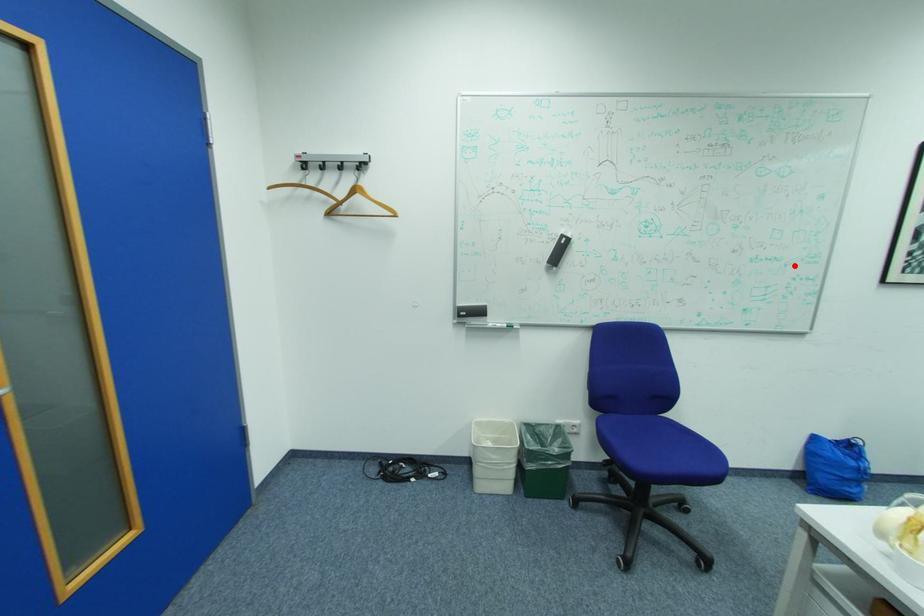
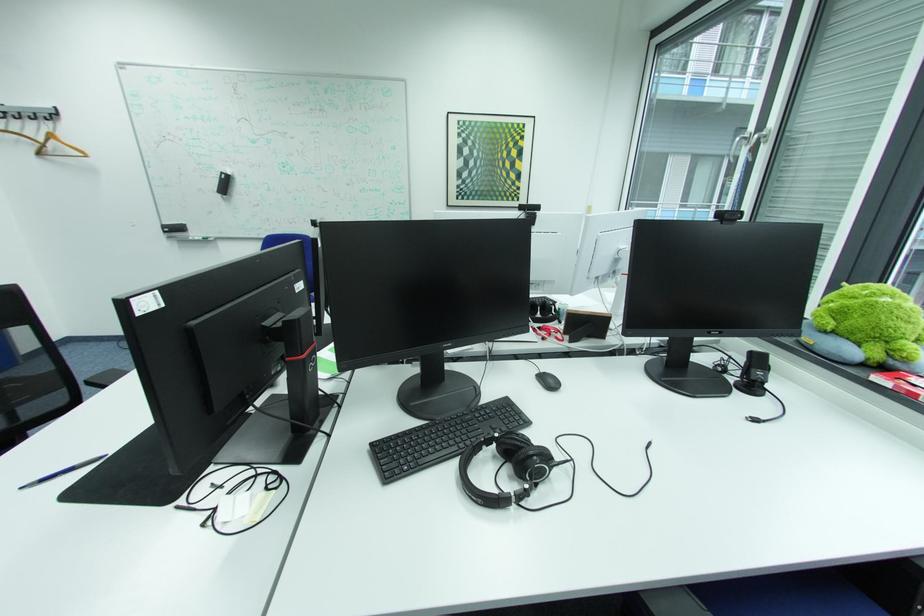
Question: I am providing you with two images of the same scene from different viewpoints. Image1 has a red point marked. In image2, the corresponding 3D location appears at what relative position? Reply with the corresponding letter.

Choices:
 (A) Closer
 (B) Farther

Answer: (A)